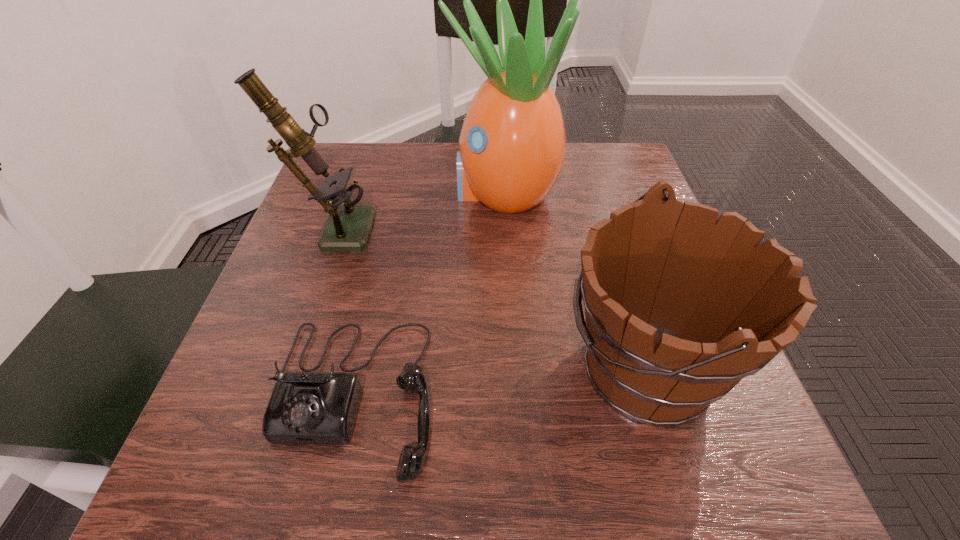
Where is `the tallest object`? The image size is (960, 540). the tallest object is located at coordinates (511, 148).

Find the location of `microscope`. microscope is located at coordinates (348, 227).

Find the location of `wine bucket`. wine bucket is located at coordinates (680, 306).

At what (x,y) coordinates should I click in order to perform the action: click on telephone. Please return your answer as a coordinate pair (x, y). Looking at the image, I should click on (309, 407).

Image resolution: width=960 pixels, height=540 pixels. Find the location of `vacant space located 0.250m at the entrance of the pineapple`. vacant space located 0.250m at the entrance of the pineapple is located at coordinates (339, 191).

Locate an element on the screen. free space located at the entrance of the pineapple is located at coordinates (348, 191).

This screenshot has width=960, height=540. Find the location of `free space located at the entrance of the pineapple`. free space located at the entrance of the pineapple is located at coordinates (361, 191).

Locate an element on the screen. free space located at the eyepiece of the microscope is located at coordinates (456, 226).

You are a GUI agent. You are given a task and a screenshot of the screen. Output one action in this format:
    pyautogui.click(x=<x>, y=<y>)
    Task: Click on the free space located 0.340m with the handle on the third tallest object
    This screenshot has width=960, height=540.
    Given the screenshot: What is the action you would take?
    pyautogui.click(x=338, y=367)

This screenshot has width=960, height=540. Identify the location of vacant region located 0.180m with the handle on the third tallest object. (443, 367).